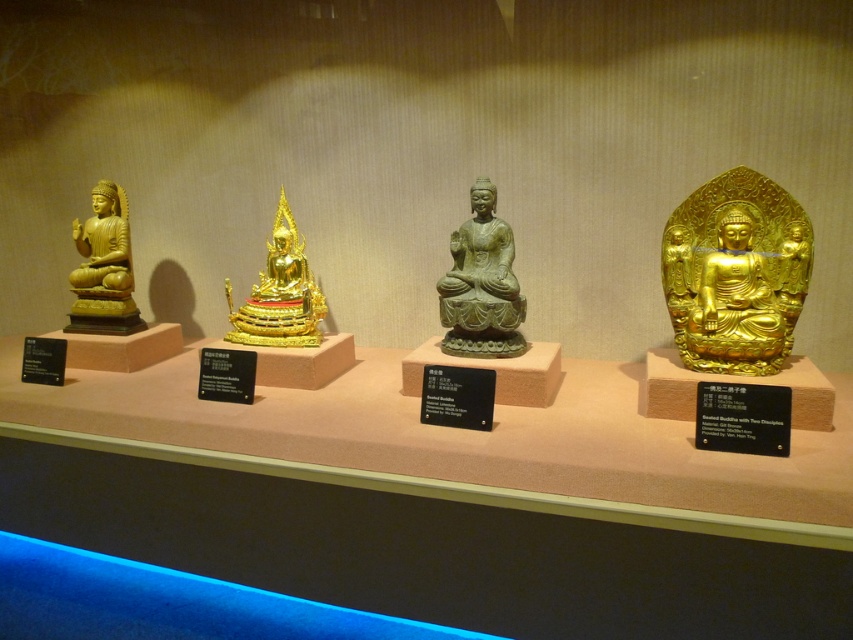
Is the point at coordinate (735,273) located on the gold statue or the plaque?

The point at coordinate (735,273) is located on the gold statue.

You are standing in front of the display of four Buddha statues. The green stone Buddha at center is located at coordinates point (480, 284). If you want to place a new statue between the leftmost golden Buddha and the green stone Buddha at center, where should you position it relative to the existing statues?

The green stone Buddha at center is located at point (480, 284). To place a new statue between the leftmost golden Buddha and the green stone Buddha at center, position it halfway between the leftmost golden Buddha and the coordinates point (480, 284).